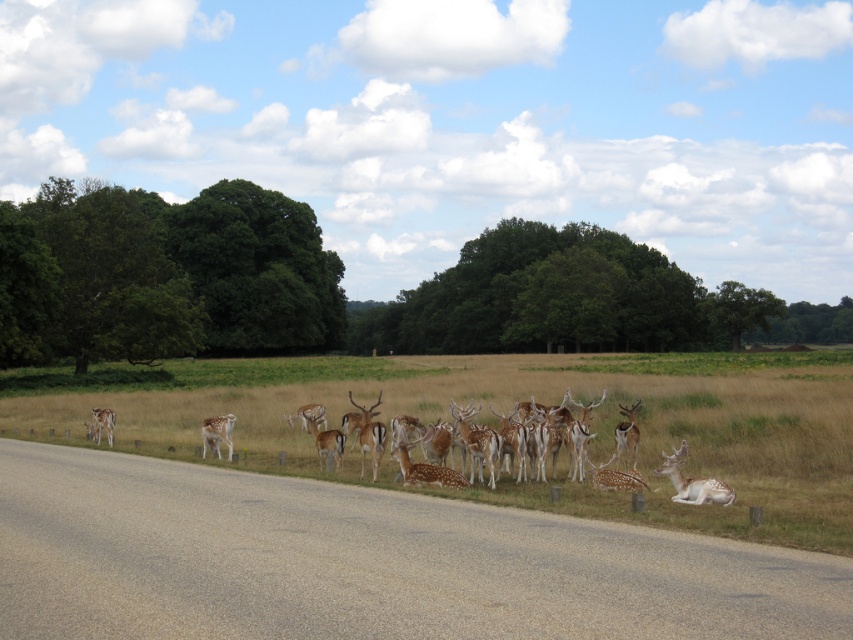
You are a wildlife photographer aiming to capture a photo of the fawn fur at road and the fawn fur at center. From your current position, which fawn fur is positioned lower in the image?

The fawn fur at road is positioned lower in the image compared to the fawn fur at center.